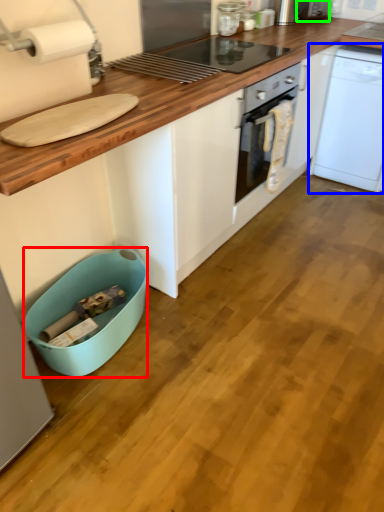
Question: Based on their relative distances, which object is nearer to dish washer (highlighted by a red box)? Choose from home appliance (highlighted by a blue box) and appliance (highlighted by a green box).

Choices:
 (A) home appliance
 (B) appliance

Answer: (A)